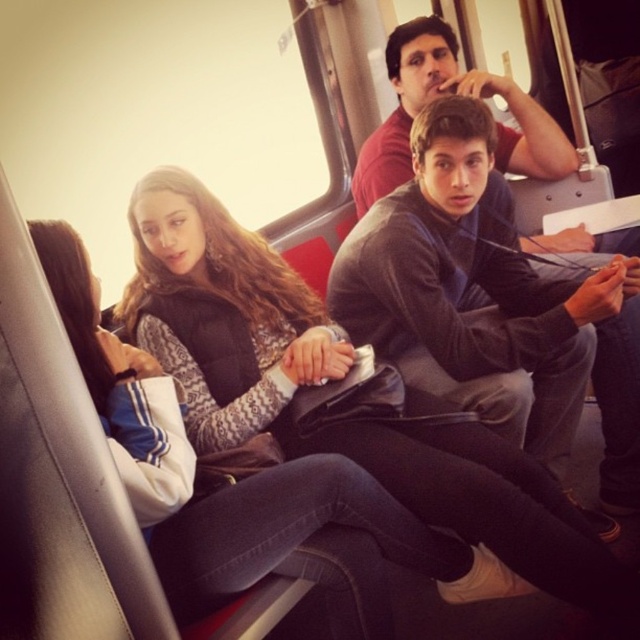
Looking at this image, is suede black jacket at center further to the viewer compared to dark gray sweater at center?

No.

Which is in front, point (444, 493) or point (566, 145)?

Point (444, 493) is in front.

Is point (413, 449) closer to viewer compared to point (637, 228)?

Yes, point (413, 449) is in front of point (637, 228).

At what (x,y) coordinates should I click in order to perform the action: click on suede black jacket at center. Please return your answer as a coordinate pair (x, y). The height and width of the screenshot is (640, 640). Looking at the image, I should click on (328, 387).